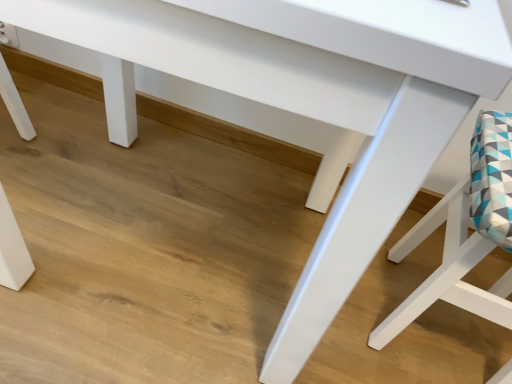
The height and width of the screenshot is (384, 512). I want to click on vacant area situated to the left side of white glossy chair at lower right, so click(295, 284).